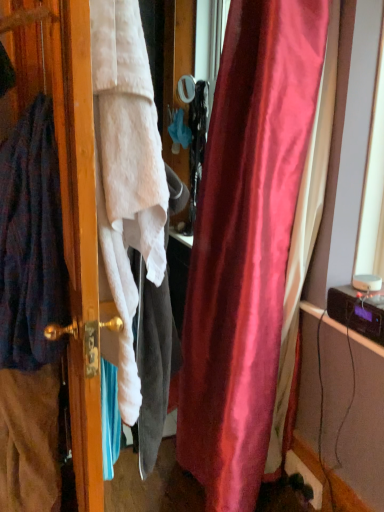
Image resolution: width=384 pixels, height=512 pixels. I want to click on white fabric screen door at left, so click(x=68, y=194).

Consider the image. What is the approximate width of white fabric screen door at left?

It is 30.51 inches.

In the scene shown: Measure the distance between white fabric screen door at left and camera.

29.54 inches.

This screenshot has width=384, height=512. What do you see at coordinates (68, 194) in the screenshot? I see `white fabric screen door at left` at bounding box center [68, 194].

The width and height of the screenshot is (384, 512). What do you see at coordinates (31, 242) in the screenshot? I see `dark blue woolen cardigan at left` at bounding box center [31, 242].

Find the location of `dark blue woolen cardigan at left`. dark blue woolen cardigan at left is located at coordinates (31, 242).

The width and height of the screenshot is (384, 512). Find the location of `white fabric screen door at left`. white fabric screen door at left is located at coordinates (68, 194).

Does dark blue woolen cardigan at left appear on the right side of white fabric screen door at left?

In fact, dark blue woolen cardigan at left is to the left of white fabric screen door at left.

Between dark blue woolen cardigan at left and white fabric screen door at left, which one is positioned behind?

dark blue woolen cardigan at left is further from the camera.

Is point (11, 300) farther from viewer compared to point (10, 51)?

No.

Looking at this image, from the image's perspective, between dark blue woolen cardigan at left and white fabric screen door at left, which one is located above?

dark blue woolen cardigan at left is shown above in the image.

From a real-world perspective, is dark blue woolen cardigan at left above or below white fabric screen door at left?

Clearly, from a real-world perspective, dark blue woolen cardigan at left is above white fabric screen door at left.

Considering the relative sizes of dark blue woolen cardigan at left and white fabric screen door at left in the image provided, is dark blue woolen cardigan at left thinner than white fabric screen door at left?

Yes.

Is dark blue woolen cardigan at left taller than white fabric screen door at left?

Incorrect, the height of dark blue woolen cardigan at left is not larger of that of white fabric screen door at left.

Between dark blue woolen cardigan at left and white fabric screen door at left, which one has smaller size?

With smaller size is dark blue woolen cardigan at left.

Do you think dark blue woolen cardigan at left is within white fabric screen door at left, or outside of it?

dark blue woolen cardigan at left is enclosed within white fabric screen door at left.

Are dark blue woolen cardigan at left and white fabric screen door at left far apart?

No, dark blue woolen cardigan at left is in close proximity to white fabric screen door at left.

Is dark blue woolen cardigan at left oriented away from white fabric screen door at left?

No, dark blue woolen cardigan at left is not facing the opposite direction of white fabric screen door at left.

How much distance is there between dark blue woolen cardigan at left and white fabric screen door at left?

They are 9.50 inches apart.

Where is `screen door that is on the right side of dark blue woolen cardigan at left`? This screenshot has width=384, height=512. screen door that is on the right side of dark blue woolen cardigan at left is located at coordinates (68, 194).

Considering the positions of objects white fabric screen door at left and dark blue woolen cardigan at left in the image provided, who is more to the left, white fabric screen door at left or dark blue woolen cardigan at left?

dark blue woolen cardigan at left.

Is white fabric screen door at left in front of or behind dark blue woolen cardigan at left in the image?

white fabric screen door at left is positioned closer to the viewer than dark blue woolen cardigan at left.

Is point (78, 46) positioned after point (51, 296)?

That is False.

From the image's perspective, which object appears higher, white fabric screen door at left or dark blue woolen cardigan at left?

From the image's view, dark blue woolen cardigan at left is above.

From a real-world perspective, is white fabric screen door at left below dark blue woolen cardigan at left?

Yes, from a real-world perspective, white fabric screen door at left is beneath dark blue woolen cardigan at left.

Considering the sizes of white fabric screen door at left and dark blue woolen cardigan at left in the image, is white fabric screen door at left wider or thinner than dark blue woolen cardigan at left?

Considering their sizes, white fabric screen door at left looks broader than dark blue woolen cardigan at left.

Considering the relative sizes of white fabric screen door at left and dark blue woolen cardigan at left in the image provided, is white fabric screen door at left taller than dark blue woolen cardigan at left?

Yes.

Considering the sizes of white fabric screen door at left and dark blue woolen cardigan at left in the image, is white fabric screen door at left bigger or smaller than dark blue woolen cardigan at left?

Clearly, white fabric screen door at left is larger in size than dark blue woolen cardigan at left.

Based on the photo, does white fabric screen door at left contain dark blue woolen cardigan at left?

Yes, dark blue woolen cardigan at left is inside white fabric screen door at left.

Are white fabric screen door at left and dark blue woolen cardigan at left beside each other?

white fabric screen door at left is not next to dark blue woolen cardigan at left, and they're not touching.

In the scene shown: Is white fabric screen door at left oriented away from dark blue woolen cardigan at left?

No, white fabric screen door at left's orientation is not away from dark blue woolen cardigan at left.

Find the location of a particular element. This screenshot has height=512, width=384. screen door located on the right of dark blue woolen cardigan at left is located at coordinates (68, 194).

Find the location of a particular element. This screenshot has height=512, width=384. cardigan above the white fabric screen door at left (from the image's perspective) is located at coordinates (31, 242).

Find the location of a particular element. screen door that appears in front of the dark blue woolen cardigan at left is located at coordinates (68, 194).